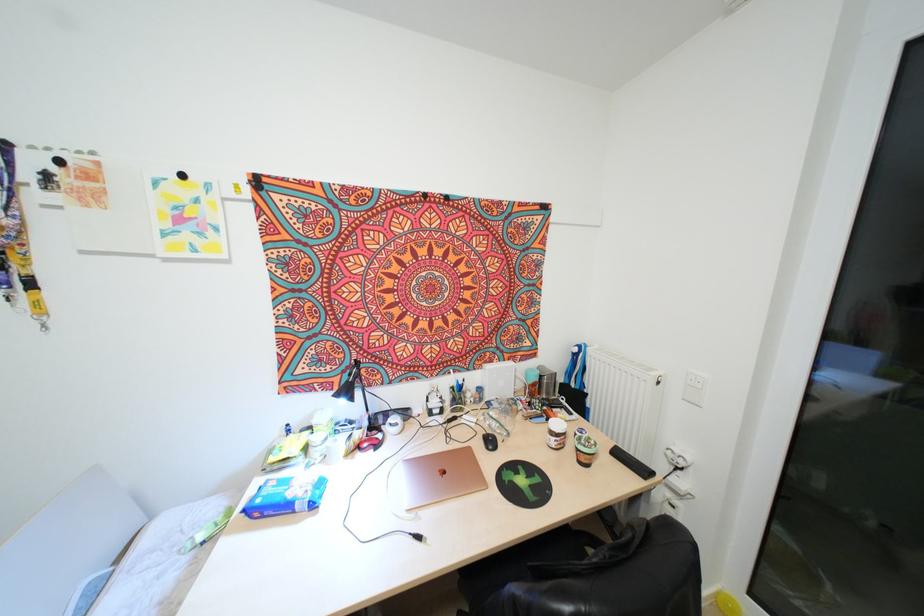
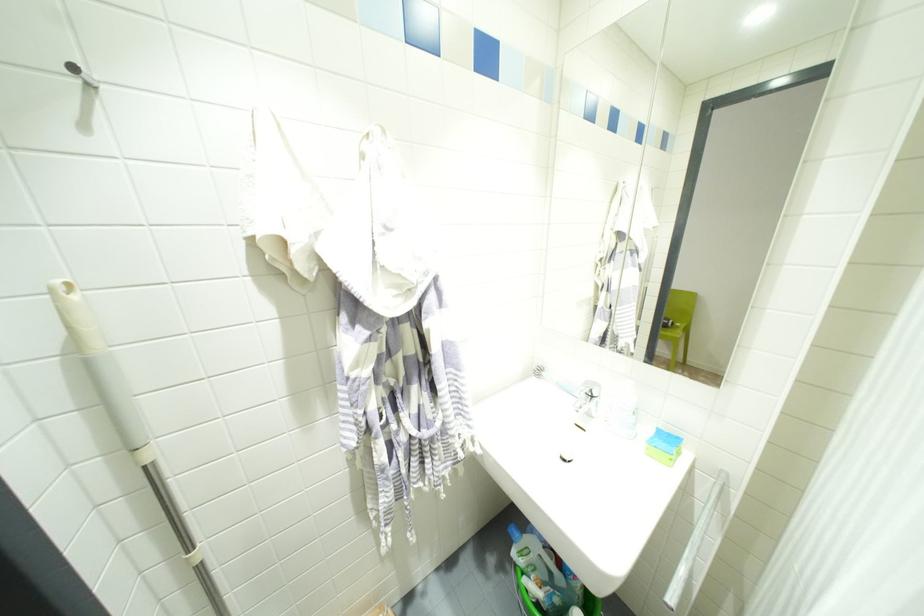
Question: I am providing you with two images of the same scene from different viewpoints. After the viewpoint changes to image2, which objects are now occluded?

Choices:
 (A) black computer mouse
 (B) black rice cooker
 (C) white mop handle
 (D) blue and green sponge

Answer: (A)